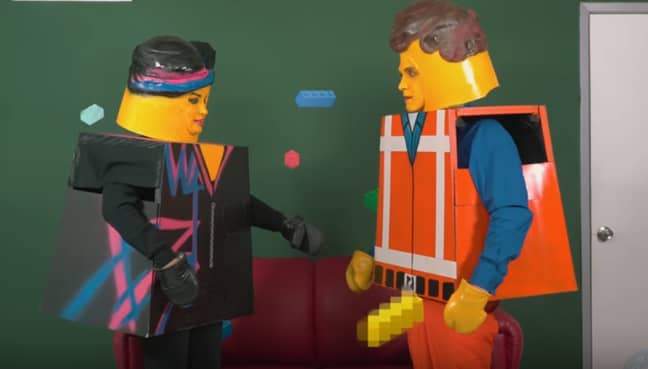
Where is `door frame on top of door`? door frame on top of door is located at coordinates (634, 6).